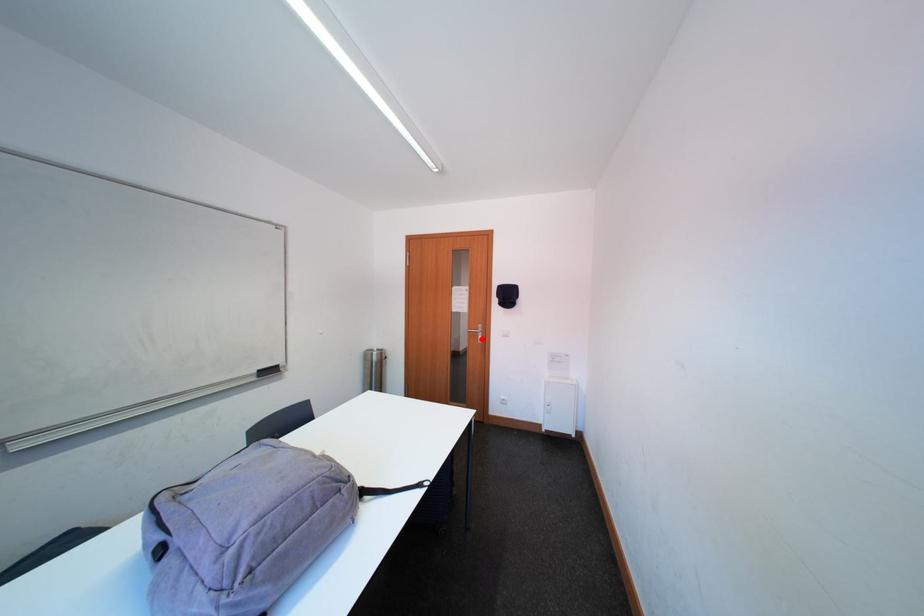
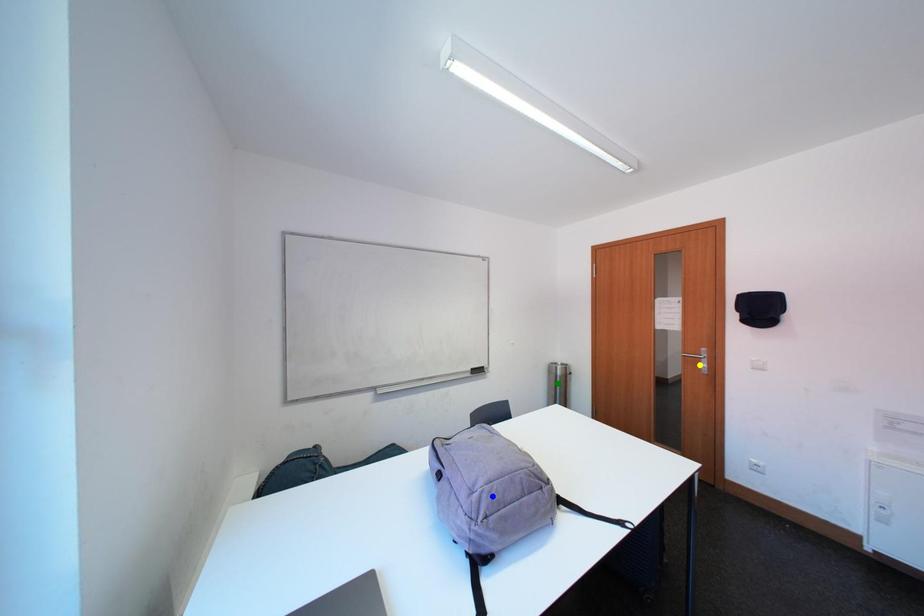
Question: I am providing you with two images of the same scene from different viewpoints. A red point is marked on the first image. You are given multiple points on the second image. Which spot in image 2 lines up with the point in image 1?

Choices:
 (A) green point
 (B) blue point
 (C) yellow point

Answer: (C)